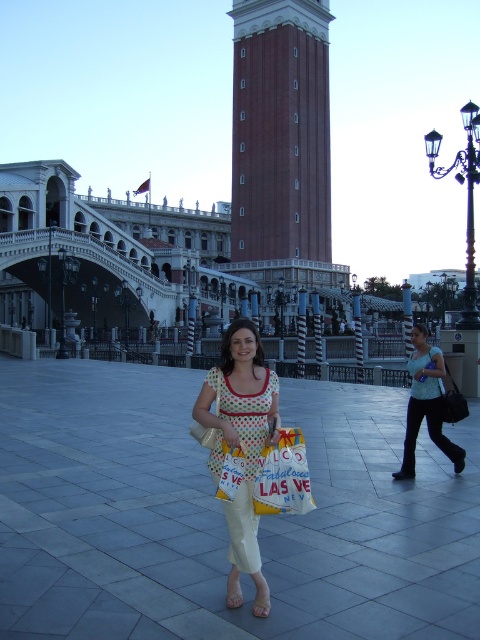
The image size is (480, 640). What are the coordinates of `red brick bell tower at center` in the screenshot? It's located at (280, 131).

Is red brick bell tower at center further to the viewer compared to yellow fabric shopping bag at center?

Yes, red brick bell tower at center is further from the viewer.

Is point (266, 6) behind point (288, 472)?

Yes, point (266, 6) is behind point (288, 472).

I want to click on red brick bell tower at center, so click(x=280, y=131).

Is the position of polka dot fabric dress at center less distant than that of light blue fabric shirt at center?

Yes, it is in front of light blue fabric shirt at center.

The width and height of the screenshot is (480, 640). Find the location of `polka dot fabric dress at center`. polka dot fabric dress at center is located at coordinates (241, 445).

Who is shorter, red brick bell tower at center or light blue fabric shirt at center?

light blue fabric shirt at center

Is point (321, 168) positioned before point (419, 401)?

No, (321, 168) is further to viewer.

Who is more distant from viewer, (259, 8) or (457, 470)?

Point (259, 8)

Where is `red brick bell tower at center`? red brick bell tower at center is located at coordinates (280, 131).